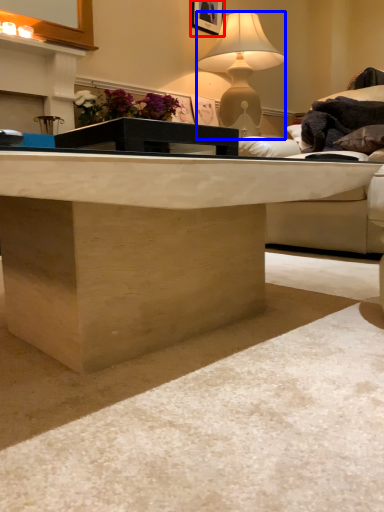
Question: Which object appears farthest to the camera in this image, picture frame (highlighted by a red box) or lamp (highlighted by a blue box)?

Choices:
 (A) picture frame
 (B) lamp

Answer: (A)